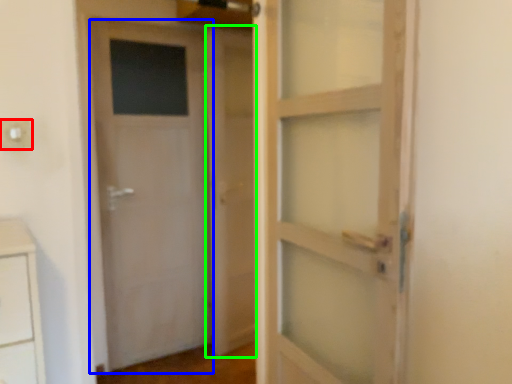
Question: Based on their relative distances, which object is farther from electric outlet (highlighted by a red box)? Choose from door (highlighted by a blue box) and barn door (highlighted by a green box).

Choices:
 (A) door
 (B) barn door

Answer: (B)